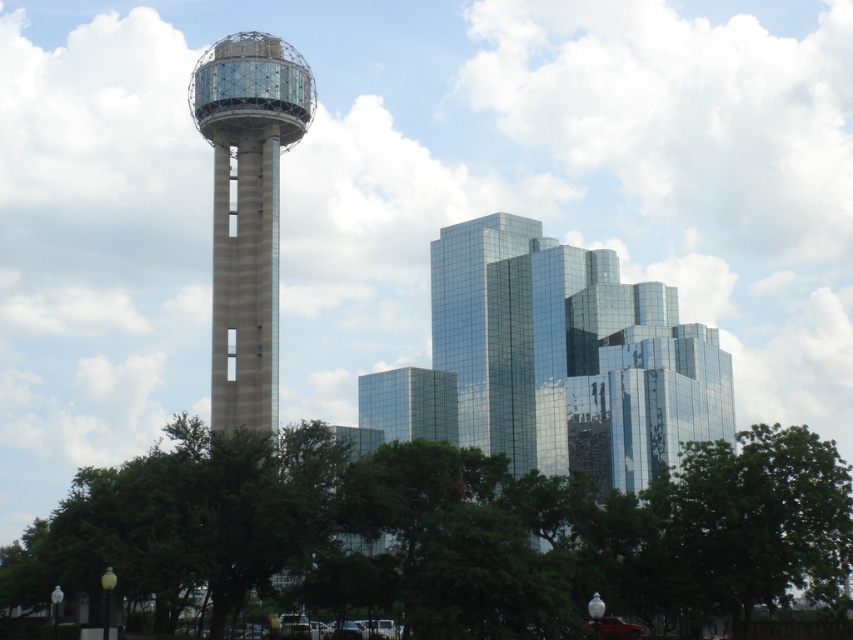
You are an architect planning to install a large billboard on the side of the glassy reflective skyscraper at center and the concrete glass tower at center. Which building would require a larger billboard to maintain the same visual impact from the ground?

The glassy reflective skyscraper at center is bigger than the concrete glass tower at center, so the billboard on the glassy reflective skyscraper at center needs to be larger to maintain the same visual impact from the ground.

You are an urban planner assessing the city layout. You notice the glassy reflective skyscraper at center and the concrete glass tower at center. Which one has a greater width?

The glassy reflective skyscraper at center has a greater width than the concrete glass tower at center according to the description provided.

You are a drone operator planning to fly a drone between the glassy reflective skyscraper at center and the concrete glass tower at center. The drone has a maximum flight distance of 200 feet. Can the drone safely fly between them without exceeding its range?

The distance between the glassy reflective skyscraper at center and the concrete glass tower at center is 194.03 feet, which is within the drone operator maximum flight distance of 200 feet. The drone can safely fly between them without exceeding its range.